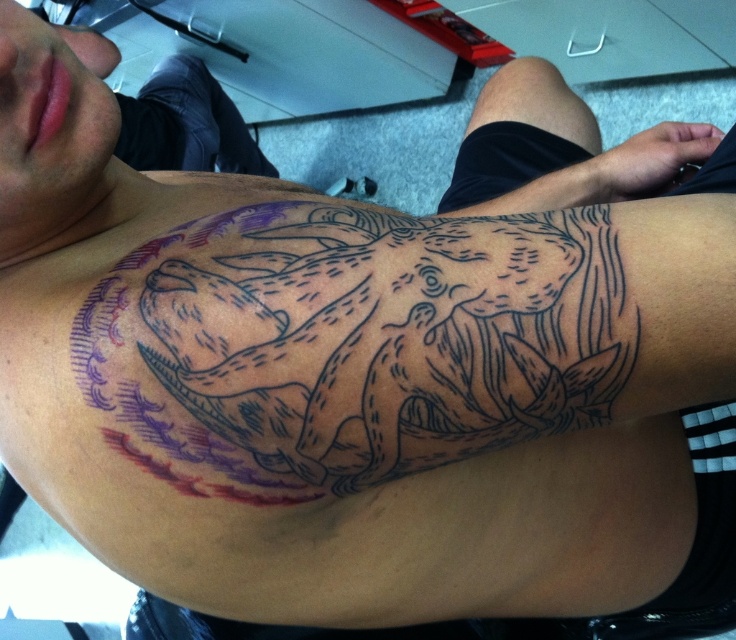
Question: Among these points, which one is nearest to the camera?

Choices:
 (A) (399, 301)
 (B) (447, 204)

Answer: (A)

Question: Can you confirm if black ink tattoo at upper center is wider than black ink tattoo at upper right?

Choices:
 (A) no
 (B) yes

Answer: (A)

Question: Can you confirm if black ink tattoo at upper center is positioned to the right of black ink tattoo at upper right?

Choices:
 (A) no
 (B) yes

Answer: (A)

Question: Considering the relative positions of black ink tattoo at upper center and black ink tattoo at upper right in the image provided, where is black ink tattoo at upper center located with respect to black ink tattoo at upper right?

Choices:
 (A) below
 (B) above

Answer: (A)